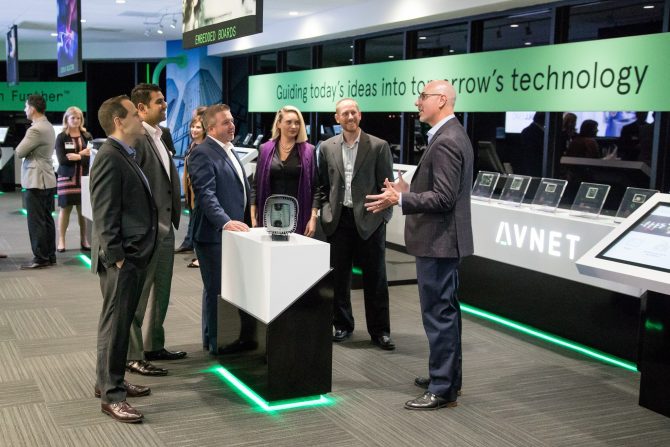
This screenshot has height=447, width=670. I want to click on tan carpet, so click(528, 400).